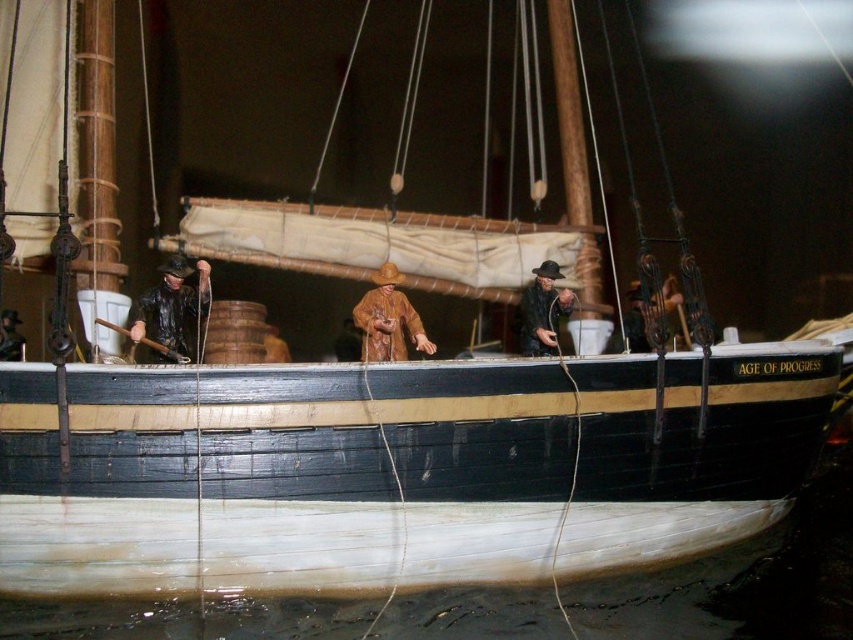
You are a historian examining the ship model. You notice the brown matte figure at center and the brown leather coat at center. Based on their positions, can you determine which object is placed higher on the deck?

The brown matte figure at center is positioned over the brown leather coat at center, so the figure is higher than the coat.

You are a historian examining the ship model and notice two coats on the deck. The first is a matte black coat at left and the second is a brown leather coat at center. Based on their positions, which coat is closer to you as an observer?

The matte black coat at left is closer to you because it is positioned in front of the brown leather coat at center.

Consider the image. You are standing on the deck of the ship labeled AGE OF PROGRESS. There are two points marked on the deck. From your position, which point is closer to you, point [151,330] or point [376,321]?

Point [151,330] is in front of point [376,321], so it is closer to you.